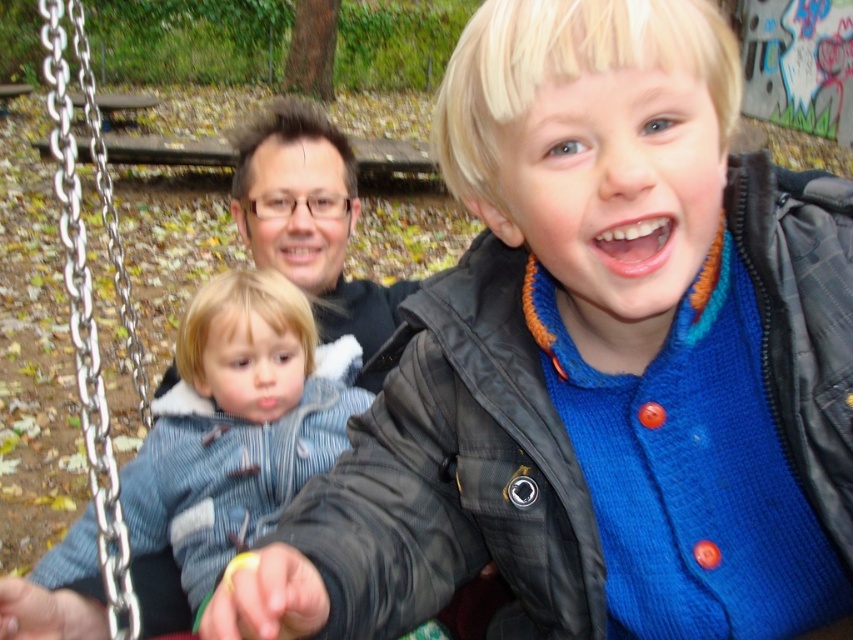
Question: Which point is farther from the camera taking this photo?

Choices:
 (A) (68, 182)
 (B) (85, 564)

Answer: (B)

Question: Which point is closer to the camera taking this photo?

Choices:
 (A) (49, 36)
 (B) (247, 518)

Answer: (A)

Question: Can you confirm if denim jacket at left is positioned below silver metallic chain at left?

Choices:
 (A) yes
 (B) no

Answer: (A)

Question: Which point is closer to the camera?

Choices:
 (A) (325, 433)
 (B) (68, 230)

Answer: (B)

Question: Does denim jacket at left have a larger size compared to silver metallic chain at left?

Choices:
 (A) no
 (B) yes

Answer: (B)

Question: Is denim jacket at left wider than silver metallic chain at left?

Choices:
 (A) yes
 (B) no

Answer: (A)